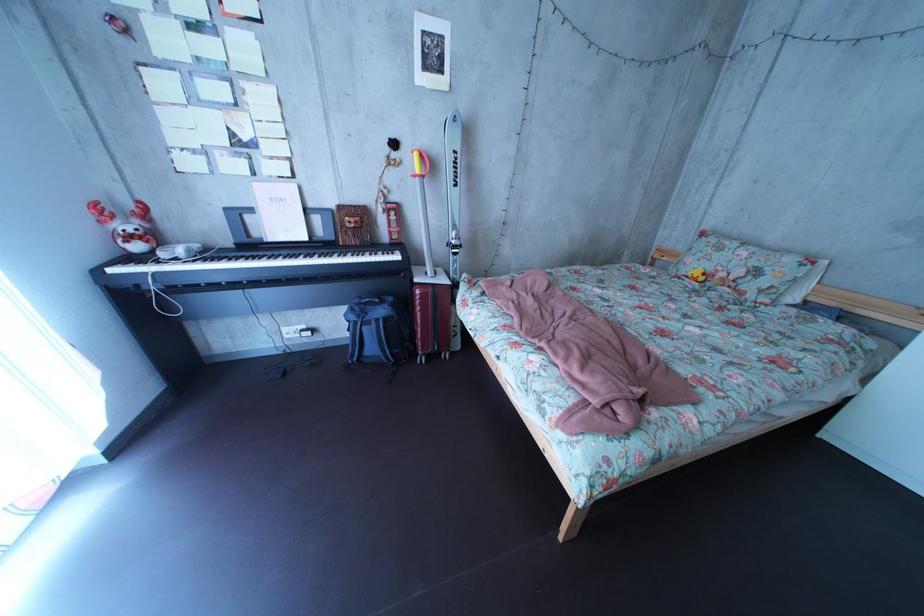
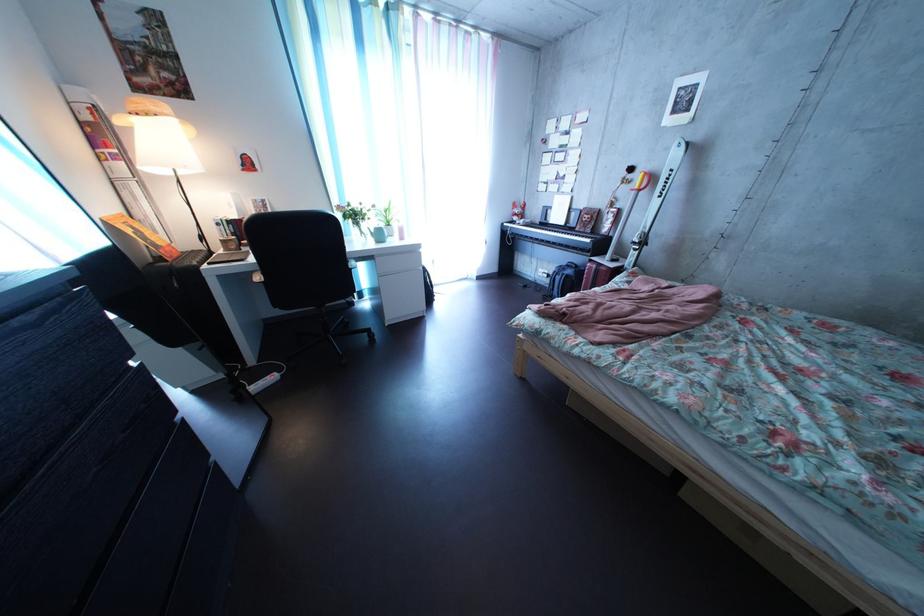
Locate, in the second image, the point that corresponds to point 438,185 in the first image.

(653, 199)